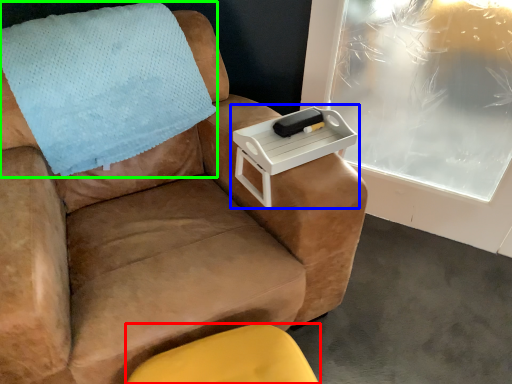
Question: Based on their relative distances, which object is farther from furniture (highlighted by a red box)? Choose from table (highlighted by a blue box) and blanket (highlighted by a green box).

Choices:
 (A) table
 (B) blanket

Answer: (B)